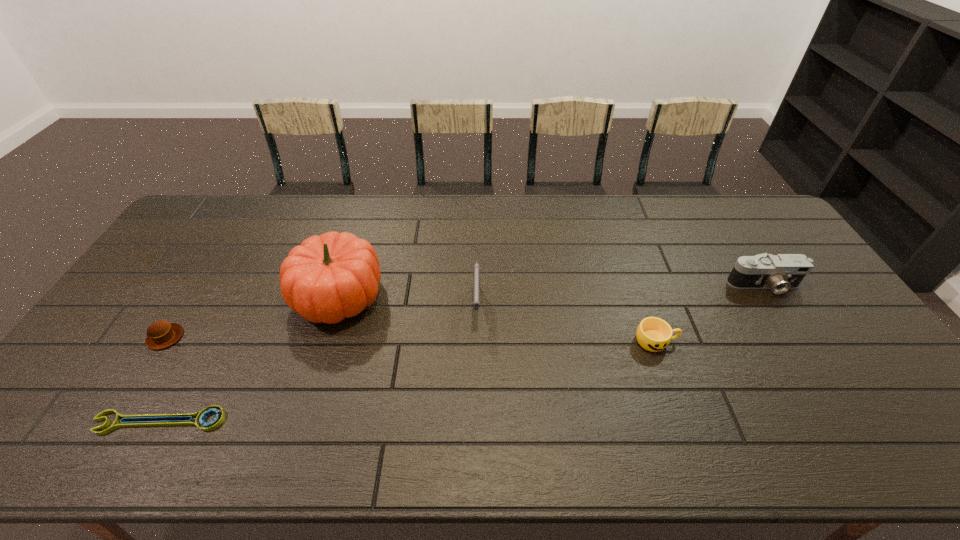
Where is `vacant position at the near edge of the desktop`? The width and height of the screenshot is (960, 540). vacant position at the near edge of the desktop is located at coordinates (534, 429).

The height and width of the screenshot is (540, 960). I want to click on free space at the left edge of the desktop, so click(x=83, y=380).

This screenshot has width=960, height=540. In order to click on free space at the right edge of the desktop in this screenshot , I will do `click(761, 254)`.

Identify the location of vacant space at the far left corner of the desktop. Image resolution: width=960 pixels, height=540 pixels. (228, 221).

This screenshot has height=540, width=960. In order to click on empty space between the pumpkin and the camera in this screenshot , I will do pyautogui.click(x=551, y=291).

You are a GUI agent. You are given a task and a screenshot of the screen. Output one action in this format:
    pyautogui.click(x=<x>, y=<y>)
    Task: Click on the empty space that is in between the third object from right to left and the rightmost object
    
    Given the screenshot: What is the action you would take?
    pyautogui.click(x=620, y=295)

At what (x,y) coordinates should I click in order to perform the action: click on free spot between the fifth object from left to right and the rightmost object. Please return your answer as a coordinate pair (x, y). Looking at the image, I should click on (709, 313).

Locate an element on the screen. free space between the tallest object and the rightmost object is located at coordinates (551, 291).

Locate an element on the screen. This screenshot has width=960, height=540. empty space that is in between the cup and the nearest object is located at coordinates (408, 381).

Find the location of `blank region between the muffin and the fifth object from left to right`. blank region between the muffin and the fifth object from left to right is located at coordinates (411, 339).